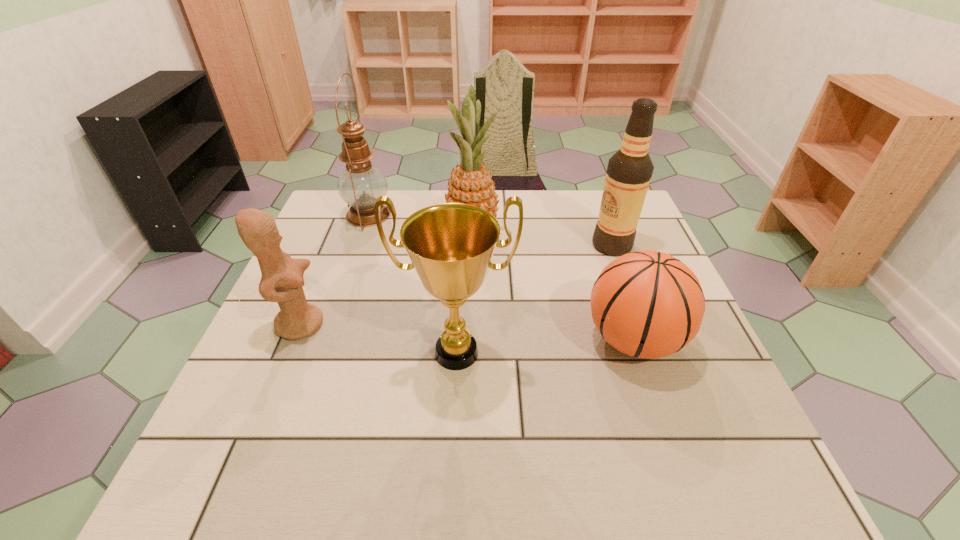
Image resolution: width=960 pixels, height=540 pixels. What are the coordinates of `oil lamp` in the screenshot? It's located at (360, 184).

This screenshot has height=540, width=960. I want to click on pineapple, so click(x=471, y=183).

Locate an element on the screen. alcohol is located at coordinates (629, 171).

Where is `award`? award is located at coordinates (451, 245).

Locate an element on the screen. The height and width of the screenshot is (540, 960). the second shortest object is located at coordinates (282, 279).

Image resolution: width=960 pixels, height=540 pixels. I want to click on the shortest object, so tap(648, 304).

Image resolution: width=960 pixels, height=540 pixels. In order to click on vacant area situated on the front of the oil lamp in this screenshot , I will do `click(354, 254)`.

Locate an element on the screen. Image resolution: width=960 pixels, height=540 pixels. blank area located 0.240m on the right of the pineapple is located at coordinates (585, 233).

In order to click on free space located 0.230m on the label of the alcohol in this screenshot , I will do `click(507, 245)`.

What are the coordinates of `vacant position located 0.240m on the label of the alcohol` in the screenshot? It's located at (503, 245).